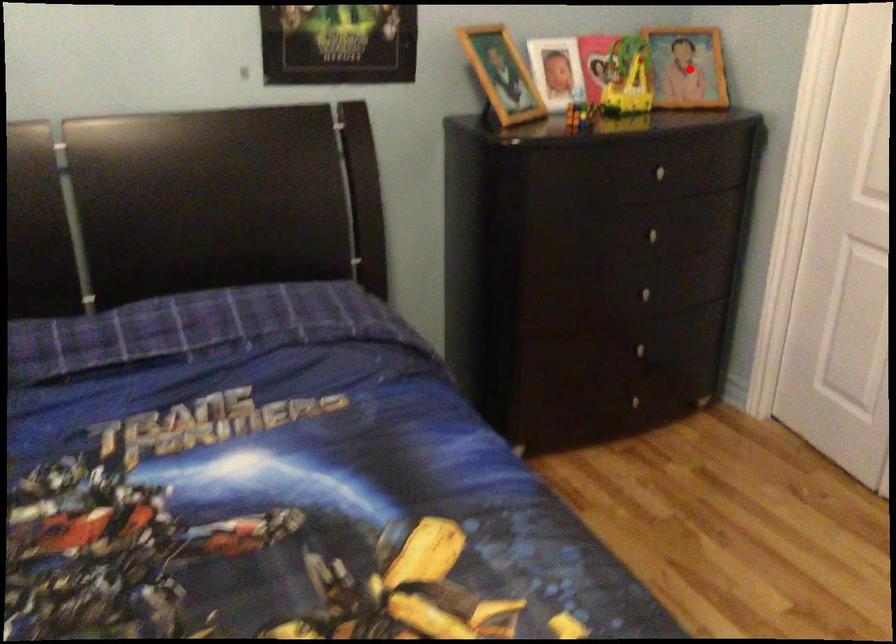
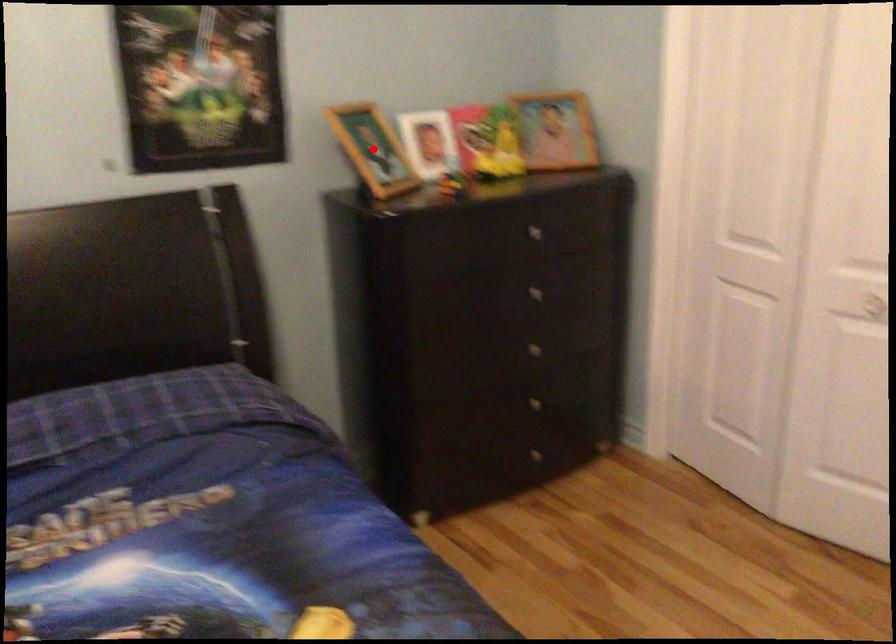
I am providing you with two images of the same scene from different viewpoints. A red point is marked on the first image and another point is marked on the second image. Are the points marked in image1 and image2 representing the same 3D position?

No